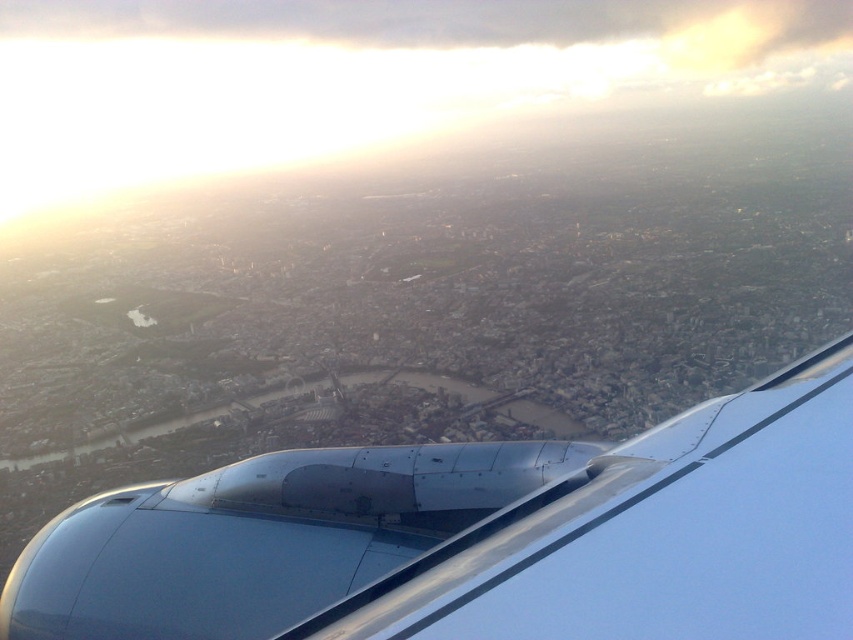
You are a flight attendant who needs to move from the metallic blue engine at lower right to the transparent glass airplane window at lower left during a safety inspection. The aisle you must walk through is 140 meters long. Will you be able to reach the window without needing to backtrack?

The metallic blue engine at lower right and transparent glass airplane window at lower left are 143.09 meters apart. Since the aisle is only 140 meters long, you will not be able to reach the window without backtracking as the distance between them exceeds the aisle length.

You are looking out of the airplane window and see two points marked on the city below. One is at coordinates point (746, 560) and the other is at point (213, 93). Which point is closer to you?

Point (746, 560) is closer to the camera than point (213, 93).